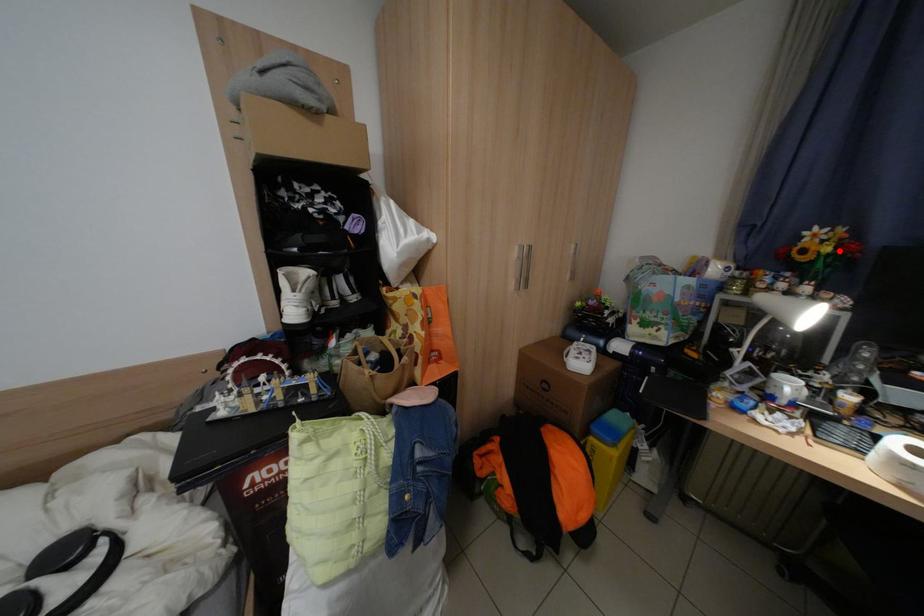
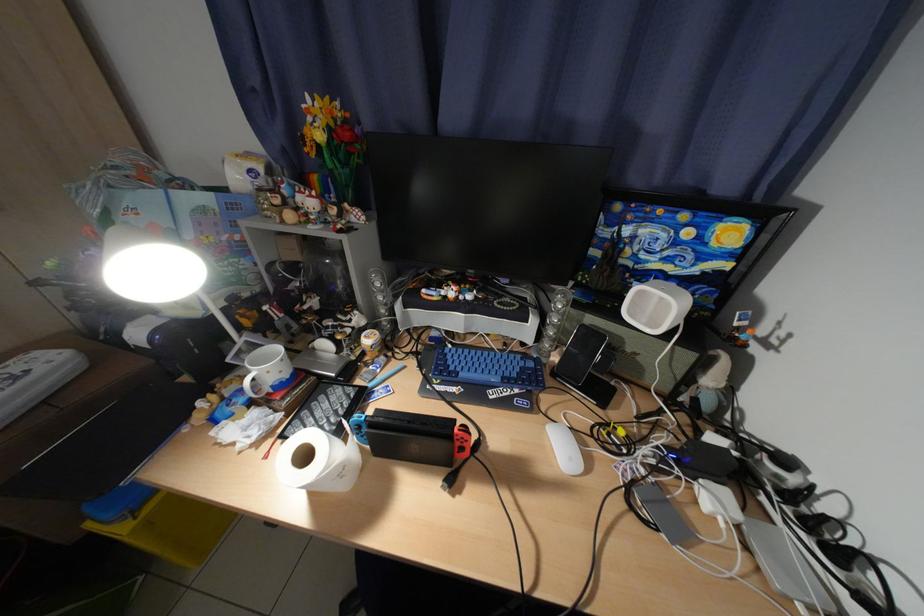
Where in the second image is the point corresponding to the highlighted location from the first image?

(331, 138)